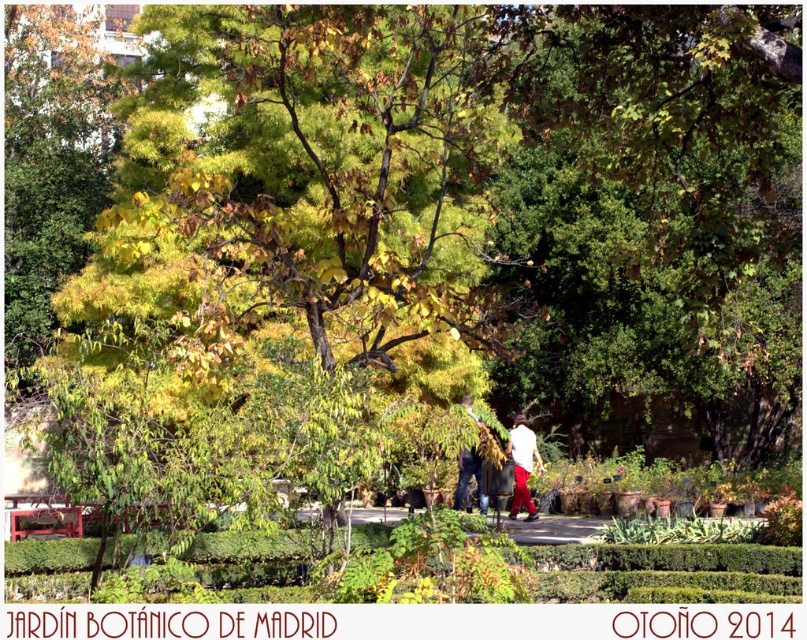
Question: Can you confirm if white matte shirt at center is positioned to the right of dark blue jeans at center?

Choices:
 (A) no
 (B) yes

Answer: (B)

Question: Which point is farther to the camera?

Choices:
 (A) white matte shirt at center
 (B) green leafy tree at center
 (C) white cotton shirt at center
 (D) dark blue jeans at center

Answer: (A)

Question: Which object is positioned farthest from the dark blue jeans at center?

Choices:
 (A) white matte shirt at center
 (B) white cotton shirt at center
 (C) green leafy tree at center

Answer: (C)

Question: Does white cotton shirt at center have a larger size compared to dark blue jeans at center?

Choices:
 (A) no
 (B) yes

Answer: (B)

Question: Estimate the real-world distances between objects in this image. Which object is closer to the white cotton shirt at center?

Choices:
 (A) green leafy tree at center
 (B) white matte shirt at center

Answer: (B)

Question: Is white cotton shirt at center below dark blue jeans at center?

Choices:
 (A) yes
 (B) no

Answer: (A)